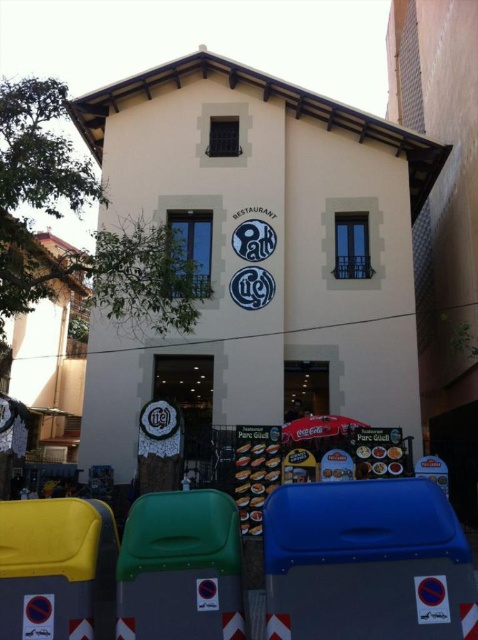
Question: Can you confirm if blue plastic bin at lower right is smaller than green plastic bin at lower left?

Choices:
 (A) no
 (B) yes

Answer: (B)

Question: Which is nearer to the green plastic bin at lower left?

Choices:
 (A) yellow plastic bin at lower left
 (B) blue plastic bin at lower right

Answer: (A)

Question: Does green plastic bin at lower left have a larger size compared to yellow plastic bin at lower left?

Choices:
 (A) no
 (B) yes

Answer: (B)

Question: Is blue plastic bin at lower right positioned before green plastic bin at lower left?

Choices:
 (A) yes
 (B) no

Answer: (A)

Question: Which of the following is the closest to the observer?

Choices:
 (A) (149, 564)
 (B) (34, 614)

Answer: (B)

Question: Which is farther from the blue plastic bin at lower right?

Choices:
 (A) yellow plastic bin at lower left
 (B) green plastic bin at lower left

Answer: (A)